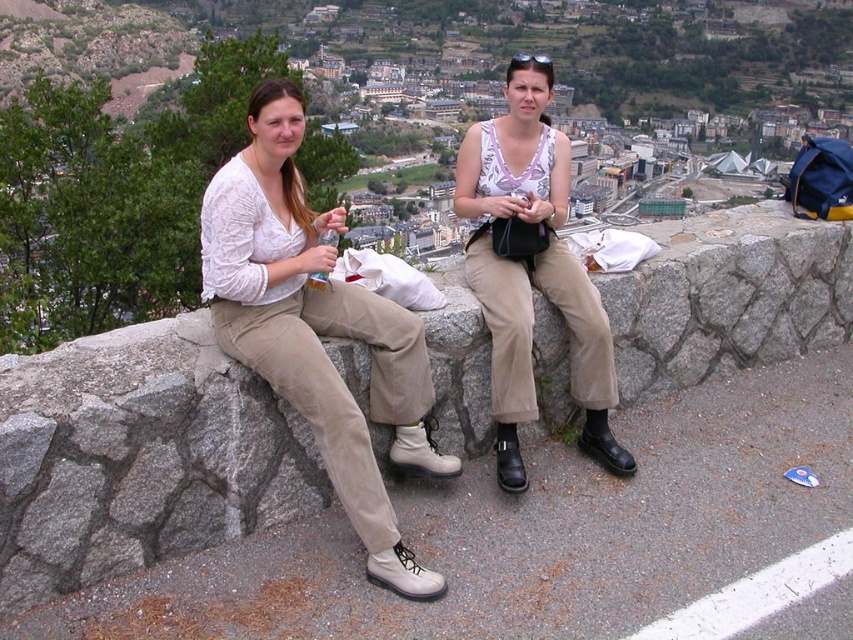
Question: Which point is closer to the camera?

Choices:
 (A) matte white blouse at upper center
 (B) matte white tank top at center
 (C) stone wall at center

Answer: (C)

Question: Does stone wall at center appear on the left side of matte white blouse at upper center?

Choices:
 (A) yes
 (B) no

Answer: (B)

Question: Which of the following is the farthest from the observer?

Choices:
 (A) (306, 243)
 (B) (550, 385)

Answer: (B)

Question: Is stone wall at center above matte white blouse at upper center?

Choices:
 (A) yes
 (B) no

Answer: (B)

Question: Can you confirm if matte white blouse at upper center is smaller than matte white tank top at center?

Choices:
 (A) no
 (B) yes

Answer: (A)

Question: Which is farther from the matte white blouse at upper center?

Choices:
 (A) stone wall at center
 (B) matte white tank top at center

Answer: (B)